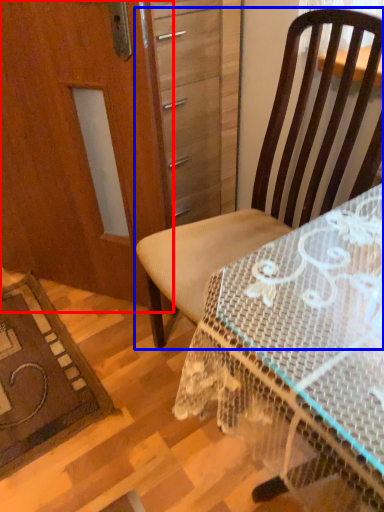
Question: Among these objects, which one is nearest to the camera, screen door (highlighted by a red box) or chair (highlighted by a blue box)?

Choices:
 (A) screen door
 (B) chair

Answer: (B)